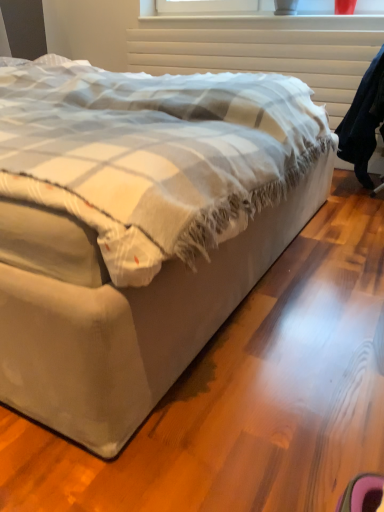
You are a GUI agent. You are given a task and a screenshot of the screen. Output one action in this format:
    pyautogui.click(x=<x>, y=<y>)
    Task: Click on the vacant space situated above white textured radiator at upper center (from a real-world perspective)
    
    Given the screenshot: What is the action you would take?
    pyautogui.click(x=249, y=26)